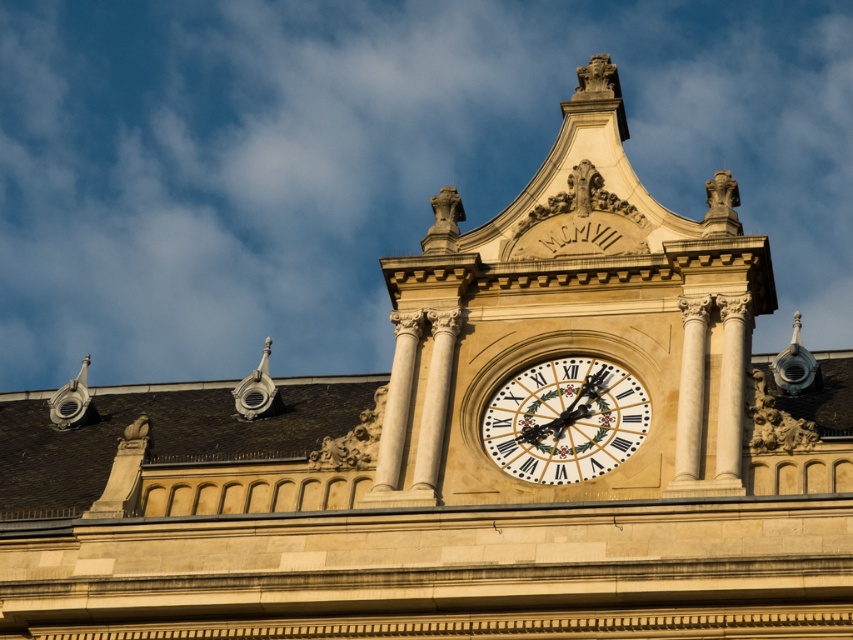
Question: Can you confirm if beige stone clock at center is wider than gold textured clock at center?

Choices:
 (A) no
 (B) yes

Answer: (B)

Question: Does beige stone clock at center have a smaller size compared to gold textured clock at center?

Choices:
 (A) no
 (B) yes

Answer: (A)

Question: Is beige stone clock at center positioned behind gold textured clock at center?

Choices:
 (A) no
 (B) yes

Answer: (A)